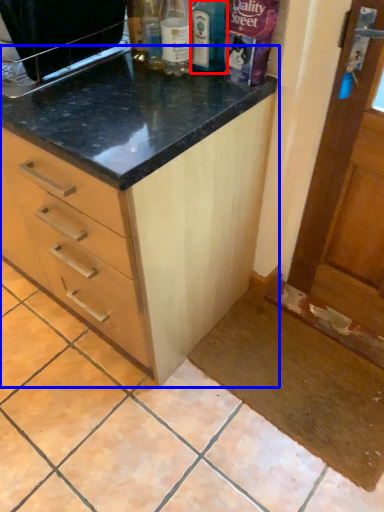
Question: Which of the following is the closest to the observer, bottle (highlighted by a red box) or cabinetry (highlighted by a blue box)?

Choices:
 (A) bottle
 (B) cabinetry

Answer: (B)